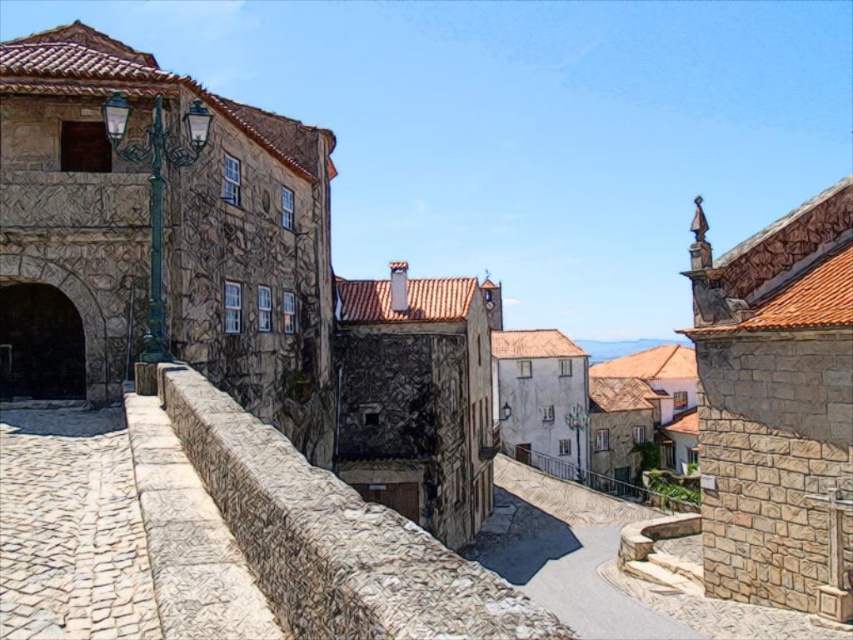
You are a tourist standing on the cobblestone street and want to sit down to rest. You notice the rustic stone ledge at center and the stone paved path at center. Which one can you sit on?

The rustic stone ledge at center is located above the stone paved path at center, so the stone paved path at center is likely the surface you can sit on since ledges are typically elevated and paths are ground level.

You are a tourist standing on the stone paved path at center and want to place a 30 inch long backpack on the rustic stone ledge at center. Will the backpack fit on the ledge?

The rustic stone ledge at center is 35.17 inches from the stone paved path at center. Since the backpack is 30 inches long, it will fit on the ledge as the ledge is longer than the backpack.